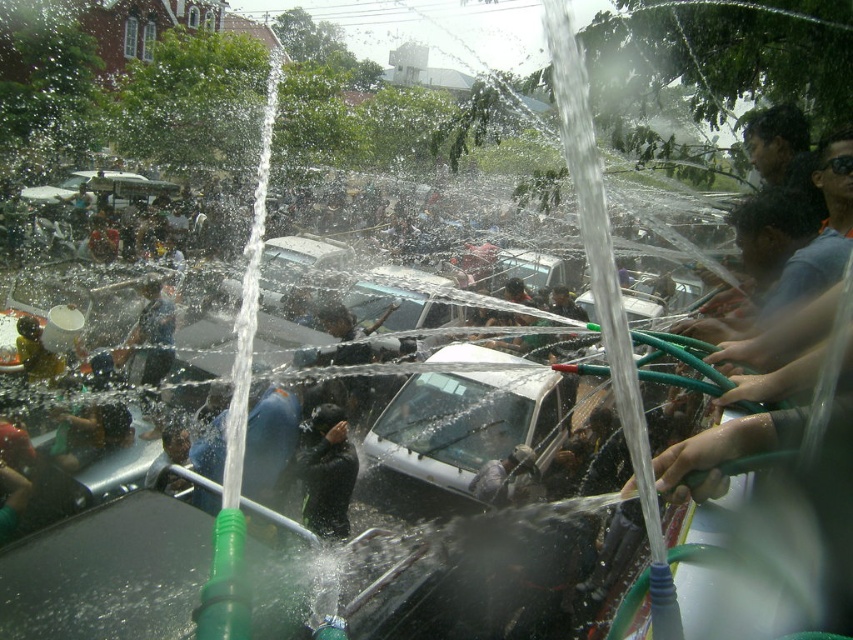
You are a photographer trying to capture a clear shot of both the white matte car at center and the black matte clothing at center in the chaotic water fight scene. Since the water jets are spraying everywhere, you need to position yourself so that neither object is obscured by water. Given their relative heights, which object should you prioritize keeping above the water spray level to ensure visibility?

The white matte car at center is taller than the black matte clothing at center. To ensure visibility, prioritize keeping the white matte car at center above the water spray level since its greater height makes it more likely to remain visible even if some spray reaches it, while the shorter black matte clothing at center would be more easily obscured by lower water jets.

You are standing at the origin of the coordinate system in the image. There are two points marked in the scene, one at point [434,483] and another at point [141,352]. Which point is closer to you?

Point [434,483] is in front of point [141,352], so it is closer to you.